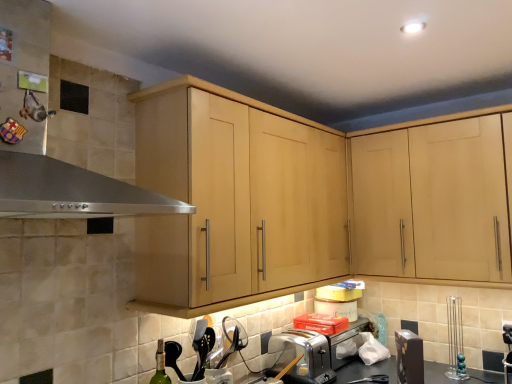
Find the location of a particular element. The width and height of the screenshot is (512, 384). empty space that is ontop of stainless steel exhaust hood at upper left (from a real-world perspective) is located at coordinates (91, 11).